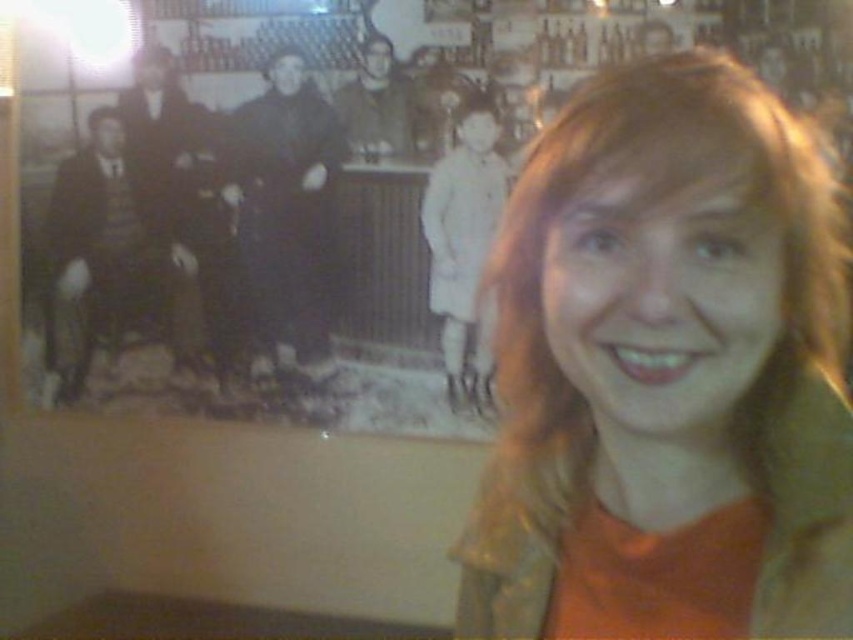
You are a fashion designer observing the image. You notice the orange fabric at center and the light beige coat at center. Which item is closer to the camera?

The orange fabric at center is closer to the camera because it is in front of the light beige coat at center.

You are a fashion designer observing a model wearing an outfit. You notice the orange fabric at center and the smooth black coat at center. Which item is located lower on the model?

The orange fabric at center is positioned under the smooth black coat at center, so it is located lower on the model.

You are a fashion designer who wants to place a new accessory exactly at the center of the smooth black coat at center. According to the coordinates provided, where should you place the accessory?

The smooth black coat at center is positioned at coordinates point (287,208), so the accessory should be placed at those coordinates to be exactly at its center.